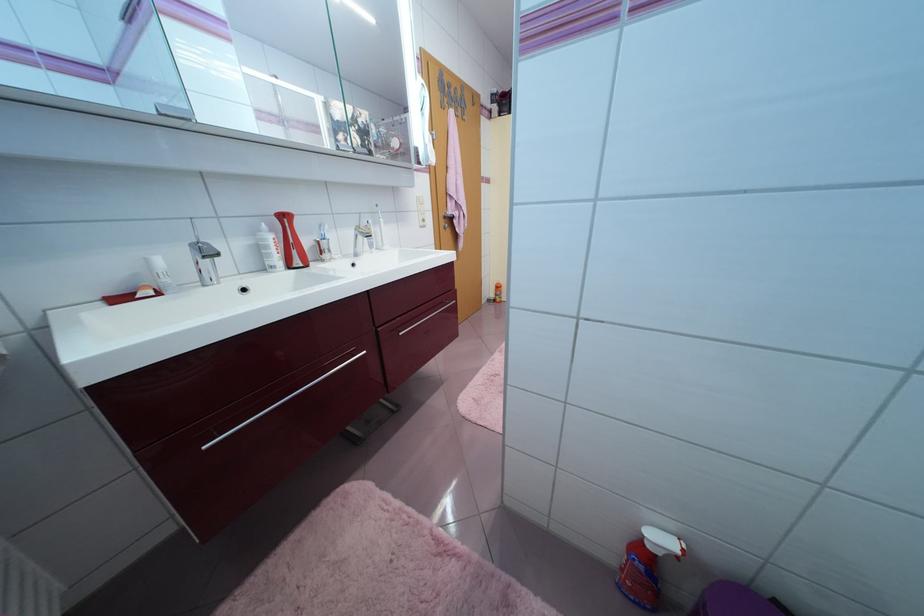
At what (x,y) coordinates should I click in order to perform the action: click on silver drawer handle. Please return your answer as a coordinate pair (x, y). This screenshot has height=616, width=924. Looking at the image, I should click on (428, 317).